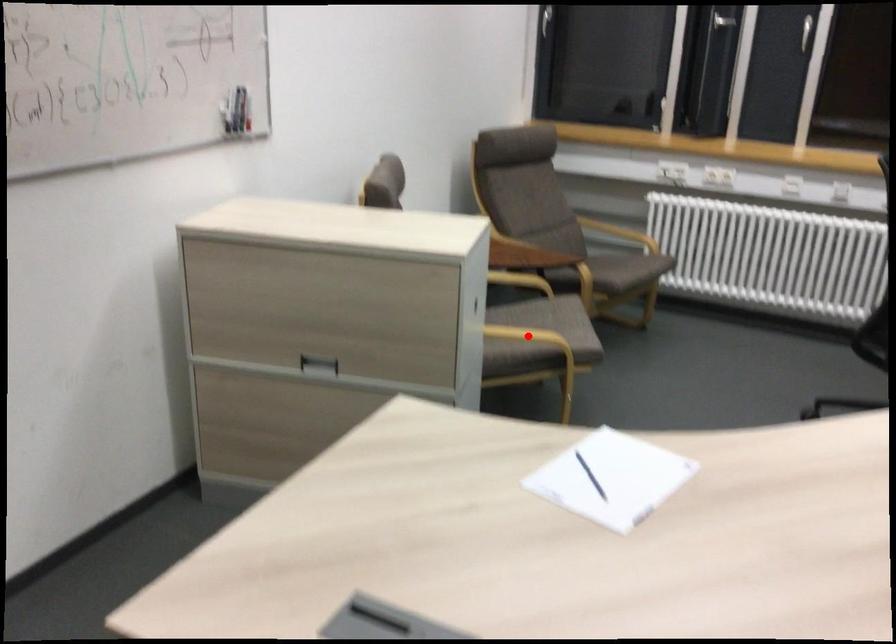
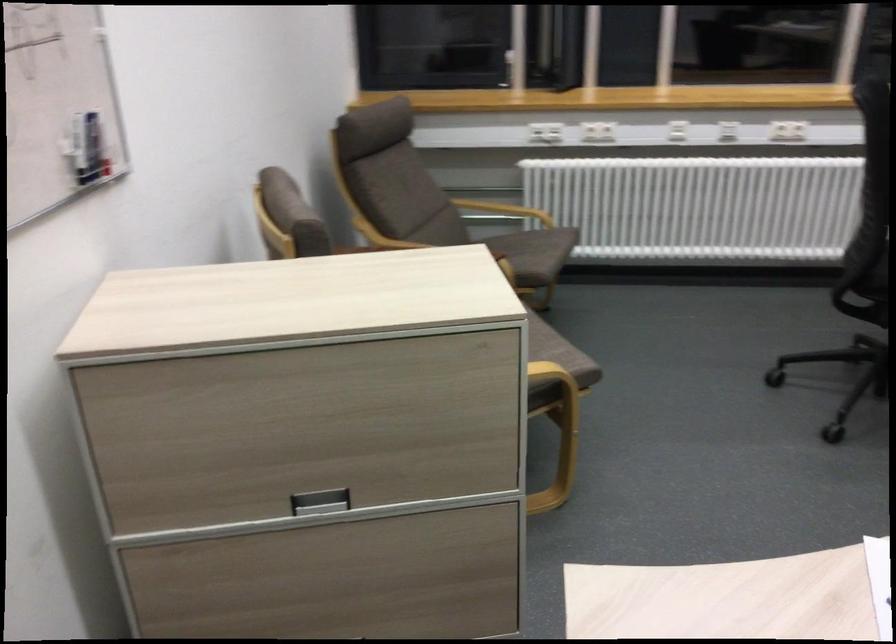
Question: I am providing you with two images of the same scene from different viewpoints. A red point is marked on the first image. At the location where the point appears in image 1, is it still visible in image 2?

Choices:
 (A) Yes
 (B) No

Answer: (B)